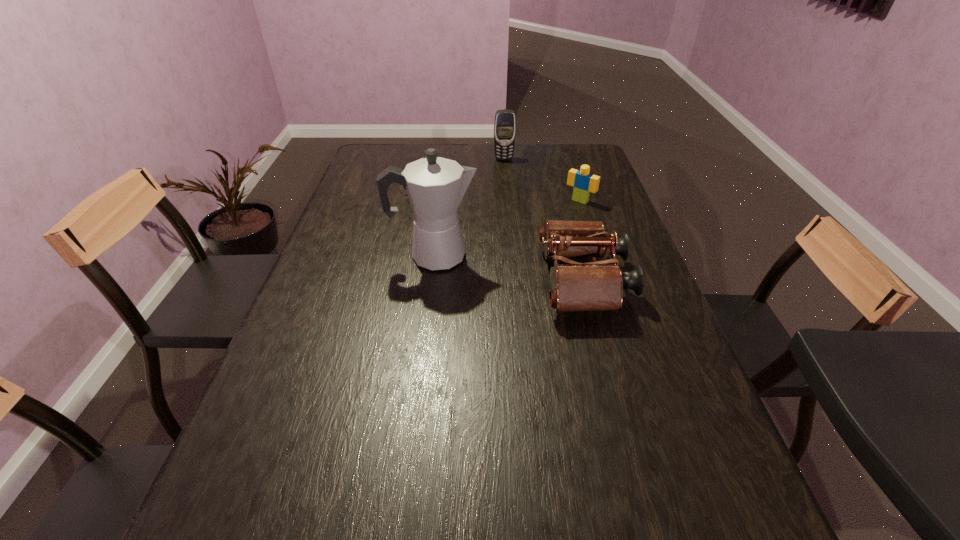
You are a GUI agent. You are given a task and a screenshot of the screen. Output one action in this format:
    pyautogui.click(x=<x>, y=<y>)
    Task: Click on the empty location between the third shortest object and the third object from left to right
    
    Given the screenshot: What is the action you would take?
    pyautogui.click(x=543, y=220)

Where is `empty space that is in between the coffeepot and the third object from left to right`? This screenshot has width=960, height=540. empty space that is in between the coffeepot and the third object from left to right is located at coordinates (468, 207).

Where is `unoccupied position between the third farthest object and the third object from right to left`? This screenshot has width=960, height=540. unoccupied position between the third farthest object and the third object from right to left is located at coordinates (541, 180).

The image size is (960, 540). I want to click on free point between the tallest object and the cellular telephone, so click(x=468, y=207).

Locate an element on the screen. free space between the third tallest object and the coffeepot is located at coordinates (508, 268).

Where is `unoccupied position between the fourth tallest object and the shortest object`? The image size is (960, 540). unoccupied position between the fourth tallest object and the shortest object is located at coordinates (499, 190).

Image resolution: width=960 pixels, height=540 pixels. Find the location of `unoccupied area between the binoculars and the fourth nearest object`. unoccupied area between the binoculars and the fourth nearest object is located at coordinates (500, 230).

In order to click on blank region between the third tallest object and the fourth shortest object in this screenshot , I will do `click(543, 220)`.

Locate which object ranks in proximity to the third nearest object. Please provide its 2D coordinates. Your answer should be formatted as a tuple, i.e. [(x, y)], where the tuple contains the x and y coordinates of a point satisfying the conditions above.

[(598, 285)]

You are a GUI agent. You are given a task and a screenshot of the screen. Output one action in this format:
    pyautogui.click(x=<x>, y=<y>)
    Task: Click on the third closest object relative to the tallest object
    This screenshot has height=540, width=960.
    Given the screenshot: What is the action you would take?
    pyautogui.click(x=584, y=182)